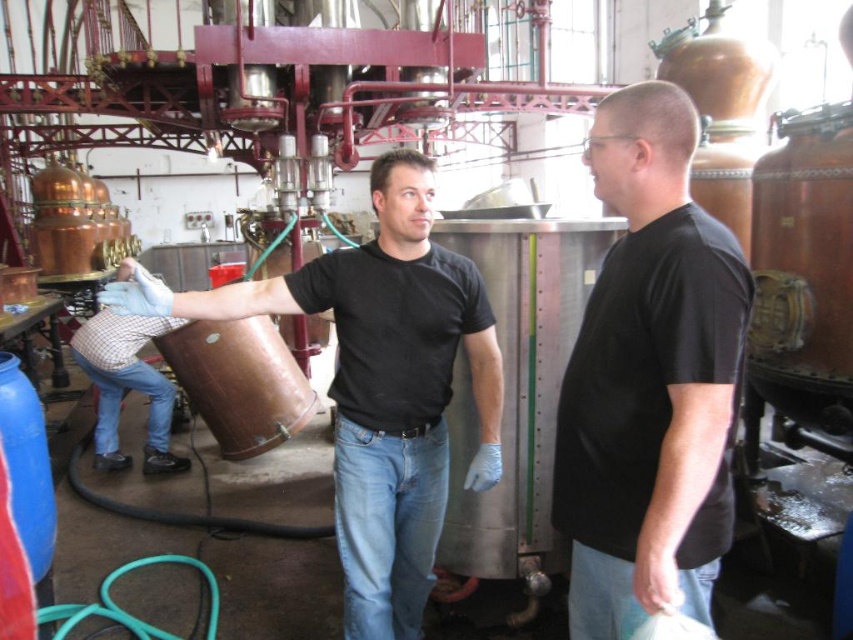
Is matte black shirt at center positioned behind checkered shirt at lower left?

No, matte black shirt at center is in front of checkered shirt at lower left.

Which is behind, point (465, 260) or point (136, 337)?

The point (136, 337) is more distant.

Is point (433, 371) behind point (149, 365)?

That is False.

I want to click on matte black shirt at center, so click(x=379, y=385).

Which is below, black matte shirt at center or checkered shirt at lower left?

checkered shirt at lower left is below.

Who is more forward, (622, 200) or (175, 468)?

Positioned in front is point (622, 200).

Find the location of a particular element. The width and height of the screenshot is (853, 640). black matte shirt at center is located at coordinates (650, 380).

At what (x,y) coordinates should I click in order to perform the action: click on black matte shirt at center. Please return your answer as a coordinate pair (x, y). Looking at the image, I should click on (650, 380).

Who is more forward, (654, 579) or (405, 273)?

Point (654, 579) is more forward.

Locate an element on the screen. black matte shirt at center is located at coordinates (650, 380).